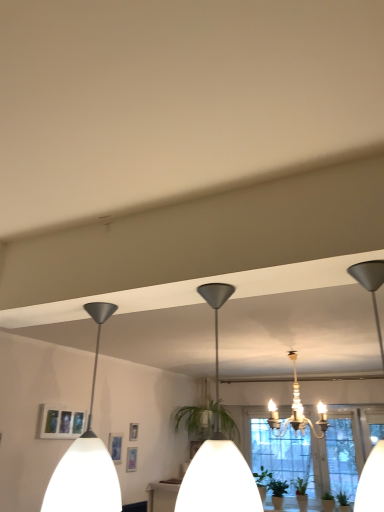
Question: From the image's perspective, is white crystal chandelier at center, acting as the 3th lamp starting from the front, on top of clear glass window at center?

Choices:
 (A) no
 (B) yes

Answer: (B)

Question: Are white crystal chandelier at center, the third lamp in the left-to-right sequence, and clear glass window at center beside each other?

Choices:
 (A) yes
 (B) no

Answer: (B)

Question: Does white crystal chandelier at center, acting as the first lamp starting from the back, come in front of clear glass window at center?

Choices:
 (A) yes
 (B) no

Answer: (A)

Question: Can you confirm if white crystal chandelier at center, which is the 1th lamp in right-to-left order, is smaller than clear glass window at center?

Choices:
 (A) no
 (B) yes

Answer: (B)

Question: Is white crystal chandelier at center, the third lamp in the left-to-right sequence, oriented away from clear glass window at center?

Choices:
 (A) no
 (B) yes

Answer: (B)

Question: Would you say white crystal chandelier at center, the third lamp in the left-to-right sequence, contains clear glass window at center?

Choices:
 (A) no
 (B) yes

Answer: (A)

Question: Is clear glass window at center bigger than matte black pendant light at center, which ranks as the second lamp in right-to-left order?

Choices:
 (A) yes
 (B) no

Answer: (A)

Question: Is clear glass window at center directly adjacent to matte black pendant light at center, which ranks as the second lamp in right-to-left order?

Choices:
 (A) no
 (B) yes

Answer: (A)

Question: Is matte black pendant light at center, which is the 1th lamp in front-to-back order, a part of clear glass window at center?

Choices:
 (A) yes
 (B) no

Answer: (B)

Question: From the image's perspective, is clear glass window at center located beneath matte black pendant light at center, marked as the third lamp in a back-to-front arrangement?

Choices:
 (A) no
 (B) yes

Answer: (B)

Question: From a real-world perspective, is clear glass window at center on matte black pendant light at center, which is the 2th lamp in left-to-right order?

Choices:
 (A) no
 (B) yes

Answer: (A)

Question: From a real-world perspective, is clear glass window at center under matte black pendant light at center, marked as the third lamp in a back-to-front arrangement?

Choices:
 (A) no
 (B) yes

Answer: (B)

Question: Is matte white picture frame at lower left inside white matte pendant light at left, the second lamp when ordered from back to front?

Choices:
 (A) no
 (B) yes

Answer: (A)